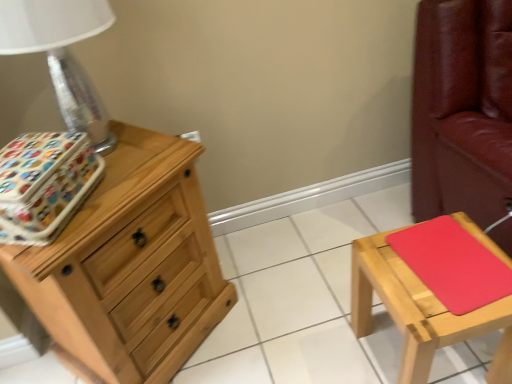
At what (x,y) coordinates should I click in order to perform the action: click on free space to the left of red matte pad at right. Please return your answer as a coordinate pair (x, y). Image resolution: width=512 pixels, height=384 pixels. Looking at the image, I should click on (393, 277).